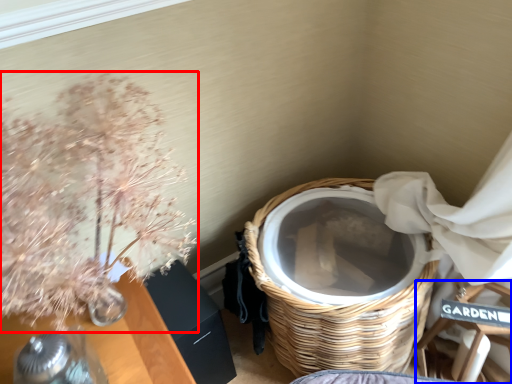
Question: Which of the following is the closest to the observer, floral arrangement (highlighted by a red box) or armchair (highlighted by a blue box)?

Choices:
 (A) floral arrangement
 (B) armchair

Answer: (A)